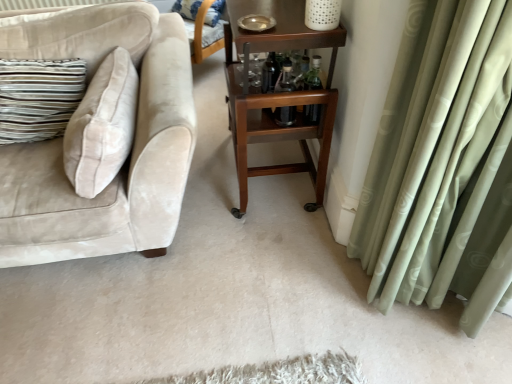
Question: Is the position of wooden rolling cart at center less distant than that of striped fabric pillow at upper center?

Choices:
 (A) yes
 (B) no

Answer: (A)

Question: Can you confirm if wooden rolling cart at center is bigger than striped fabric pillow at upper center?

Choices:
 (A) no
 (B) yes

Answer: (B)

Question: Could striped fabric pillow at upper center be considered to be inside wooden rolling cart at center?

Choices:
 (A) no
 (B) yes

Answer: (A)

Question: From the image's perspective, is wooden rolling cart at center under striped fabric pillow at upper center?

Choices:
 (A) no
 (B) yes

Answer: (B)

Question: From a real-world perspective, is wooden rolling cart at center below striped fabric pillow at upper center?

Choices:
 (A) no
 (B) yes

Answer: (A)

Question: From the image's perspective, does wooden rolling cart at center appear higher than striped fabric pillow at upper center?

Choices:
 (A) yes
 (B) no

Answer: (B)

Question: Is beige velvet couch at left bigger than transparent glass bottle at center, acting as the first bottle starting from the left?

Choices:
 (A) no
 (B) yes

Answer: (B)

Question: Does beige velvet couch at left have a lesser width compared to transparent glass bottle at center, the 2th bottle positioned from the right?

Choices:
 (A) no
 (B) yes

Answer: (A)

Question: From the image's perspective, is beige velvet couch at left below transparent glass bottle at center, acting as the first bottle starting from the left?

Choices:
 (A) no
 (B) yes

Answer: (B)

Question: Would you say beige velvet couch at left is outside transparent glass bottle at center, acting as the first bottle starting from the left?

Choices:
 (A) no
 (B) yes

Answer: (B)

Question: Considering the relative positions of beige velvet couch at left and transparent glass bottle at center, the 2th bottle positioned from the right, in the image provided, is beige velvet couch at left to the right of transparent glass bottle at center, the 2th bottle positioned from the right, from the viewer's perspective?

Choices:
 (A) no
 (B) yes

Answer: (A)

Question: Is beige velvet couch at left at the left side of transparent glass bottle at center, the 2th bottle positioned from the right?

Choices:
 (A) yes
 (B) no

Answer: (A)

Question: From a real-world perspective, is striped fabric pillow at upper center positioned over clear glass bottles at center, marked as the 1th bottle in a right-to-left arrangement, based on gravity?

Choices:
 (A) no
 (B) yes

Answer: (A)